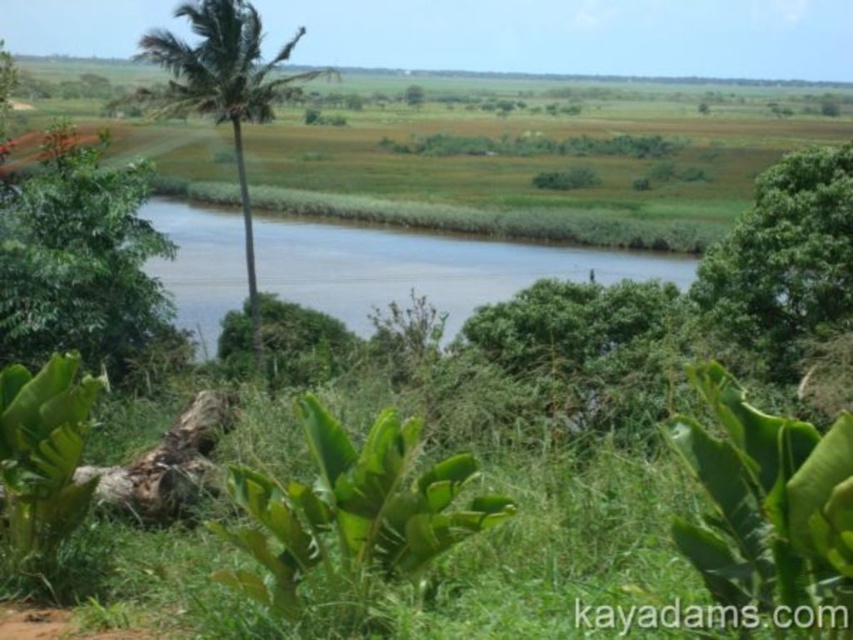
In the scene shown: Between green leafy tree at left and green leafy palm tree at left, which one has more height?

With more height is green leafy palm tree at left.

Where is `green leafy tree at left`? green leafy tree at left is located at coordinates (80, 262).

Find the location of `green leafy tree at left`. green leafy tree at left is located at coordinates (80, 262).